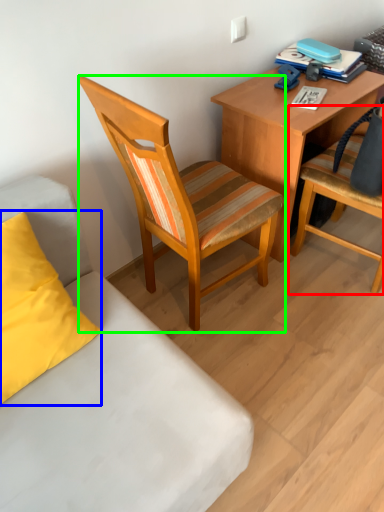
Question: Estimate the real-world distances between objects in this image. Which object is closer to chair (highlighted by a red box), pillow (highlighted by a blue box) or chair (highlighted by a green box)?

Choices:
 (A) pillow
 (B) chair

Answer: (B)